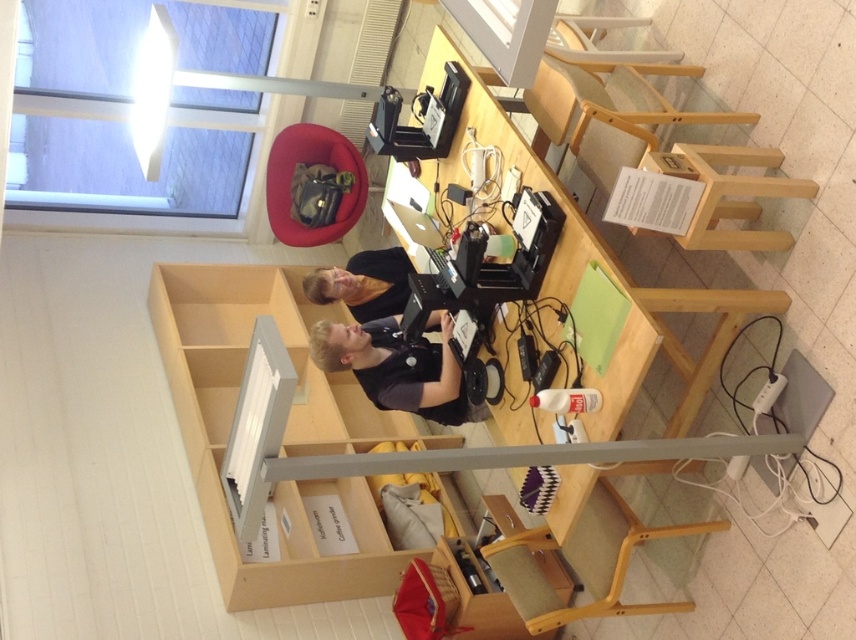
You are organizing a clothing donation drive and have two shirts in front of you on a table in a well lit library workspace. The shirts are labeled as the dark gray shirt at center and the matte black shirt at center. Which shirt is taller?

The dark gray shirt at center is taller than the matte black shirt at center.

You are organizing a clothing donation drive and need to stack shirts properly. You have a dark gray shirt at center and a matte black shirt at center. According to the image, which shirt should be placed on top to match the arrangement shown?

The matte black shirt at center should be placed on top since the dark gray shirt at center is below it in the image.